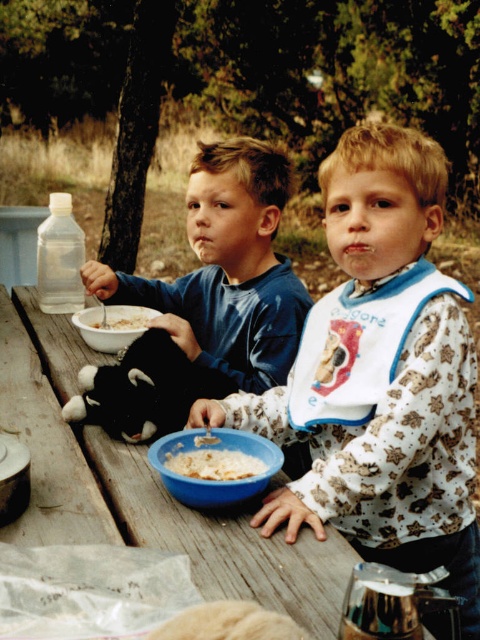
You are a parent preparing lunch for your child. You have a white cotton bib at center and a bowl of white creamy cereal at bowl center. Which item is larger in size?

The white cotton bib at center is bigger than the white creamy cereal at bowl center.

From the picture: You are a parent preparing lunch for your children. You have a matte plastic bowl of cereal at center and white fluffy rice at lower center. Which one is taller?

The matte plastic bowl of cereal at center is taller than the white fluffy rice at lower center.